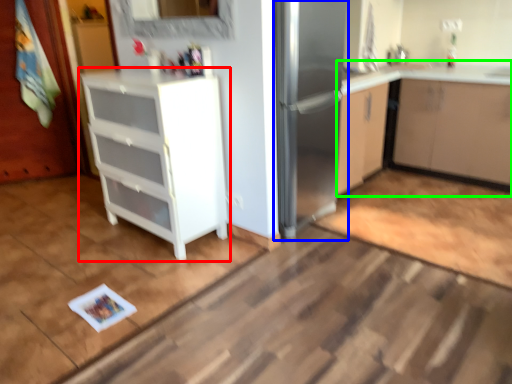
Question: Which object is the closest to the cabinetry (highlighted by a red box)? Choose among these: fridge (highlighted by a blue box) or cabinetry (highlighted by a green box).

Choices:
 (A) fridge
 (B) cabinetry

Answer: (A)